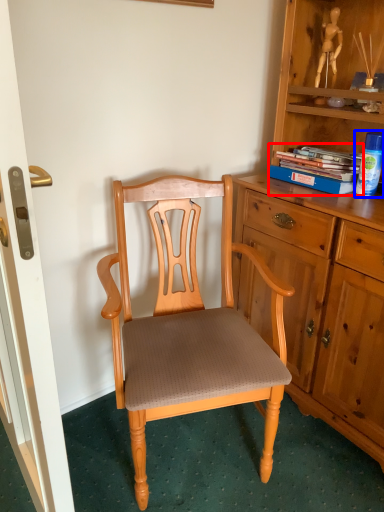
Question: Among these objects, which one is farthest to the camera, book (highlighted by a red box) or toy (highlighted by a blue box)?

Choices:
 (A) book
 (B) toy

Answer: (A)